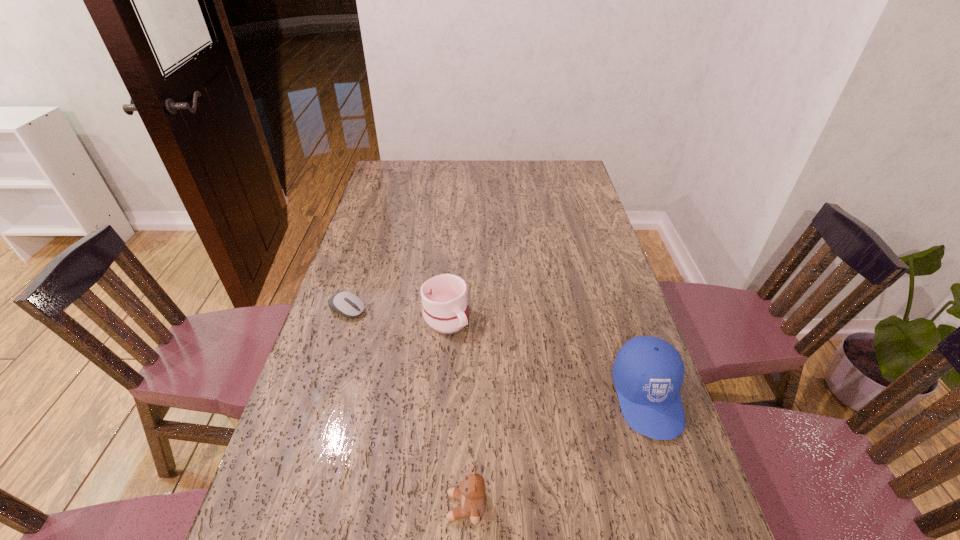
Image resolution: width=960 pixels, height=540 pixels. Find the location of `vacant space at the left edge of the desktop`. vacant space at the left edge of the desktop is located at coordinates (350, 273).

Image resolution: width=960 pixels, height=540 pixels. Find the location of `free space at the right edge`. free space at the right edge is located at coordinates [x=596, y=332].

Locate an element on the screen. The height and width of the screenshot is (540, 960). free space at the near right corner of the desktop is located at coordinates (668, 501).

Locate an element on the screen. This screenshot has width=960, height=540. free spot between the rightmost object and the computer equipment is located at coordinates (497, 353).

Where is `empty space that is in between the cap and the mug`? The height and width of the screenshot is (540, 960). empty space that is in between the cap and the mug is located at coordinates (546, 357).

You are a GUI agent. You are given a task and a screenshot of the screen. Output one action in this format:
    pyautogui.click(x=<x>, y=<y>)
    Task: Click on the free area in between the mug and the nearest object
    The width and height of the screenshot is (960, 540).
    Given the screenshot: What is the action you would take?
    [456, 412]

Find the location of a particular element. The image size is (960, 540). free space that is in between the computer equipment and the cap is located at coordinates 497,353.

This screenshot has height=540, width=960. I want to click on free point between the teddy bear and the leftmost object, so click(407, 408).

Identify the location of free space that is in between the rightmost object and the teddy bear. (557, 452).

You are a GUI agent. You are given a task and a screenshot of the screen. Output one action in this format:
    pyautogui.click(x=<x>, y=<y>)
    Task: Click on the free space that is in between the shortest object and the teddy bear
    
    Given the screenshot: What is the action you would take?
    pyautogui.click(x=407, y=408)